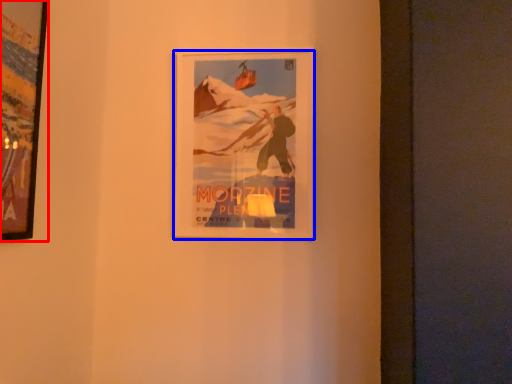
Question: Among these objects, which one is nearest to the camera, picture frame (highlighted by a red box) or picture frame (highlighted by a blue box)?

Choices:
 (A) picture frame
 (B) picture frame

Answer: (A)